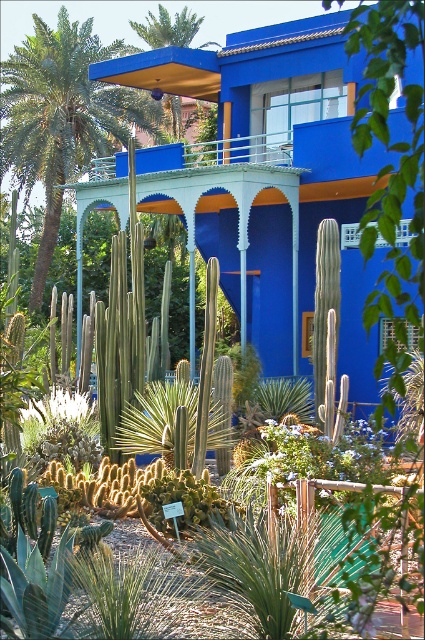
Question: Is green leafy palm tree at upper left closer to the viewer compared to green leafy palm tree at upper center?

Choices:
 (A) no
 (B) yes

Answer: (B)

Question: Can you confirm if green leafy palm tree at upper left is thinner than green leafy palm tree at upper center?

Choices:
 (A) yes
 (B) no

Answer: (B)

Question: Among these objects, which one is nearest to the camera?

Choices:
 (A) green leafy palm tree at upper center
 (B) green leafy palm tree at upper left

Answer: (B)

Question: Is green leafy palm tree at upper left to the right of green leafy palm tree at upper center from the viewer's perspective?

Choices:
 (A) yes
 (B) no

Answer: (B)